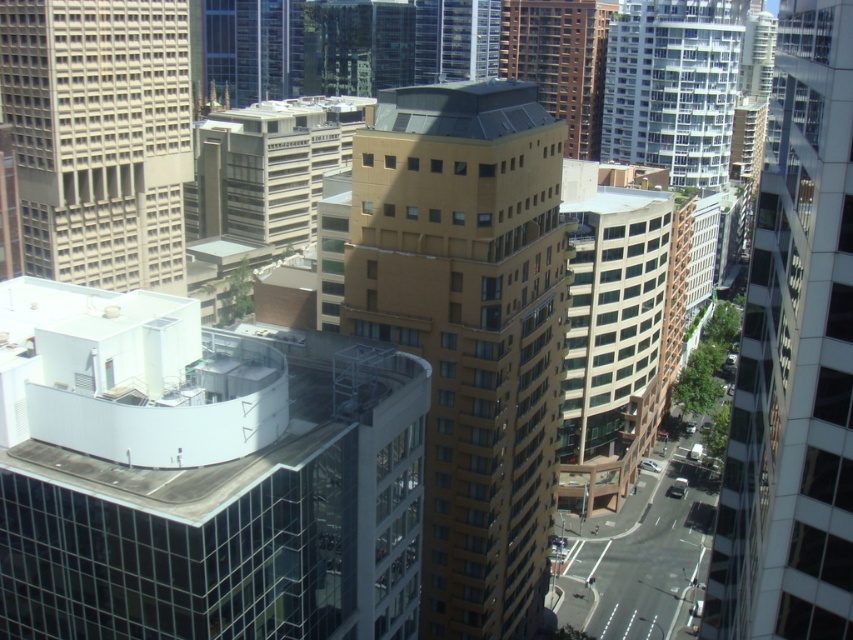
You are a city planner assessing the width of buildings for potential expansion projects. Given the white glass building at upper right and the brown glassy building at center, which one could potentially accommodate a wider expansion based on their current widths?

The white glass building at upper right might be wider than brown glassy building at center, so it could potentially accommodate a wider expansion.

You are standing at the camera position and want to take a photo of the matte gold building at center. If your camera has a maximum zoom range of 50 meters, can you capture the entire building in the photo without moving closer?

The matte gold building at center and camera are 74.91 meters apart from each other. Since the distance exceeds the camera maximum zoom range of 50 meters, you cannot capture the entire building in the photo without moving closer.

You are a drone operator trying to deliver a package to the brown glass building at center. The delivery zone is marked by a point at coordinates [793,358]. Is this point located on the building or somewhere else?

The point at coordinates [793,358] indicates the brown glass building at center, so the delivery zone is located on the building itself.